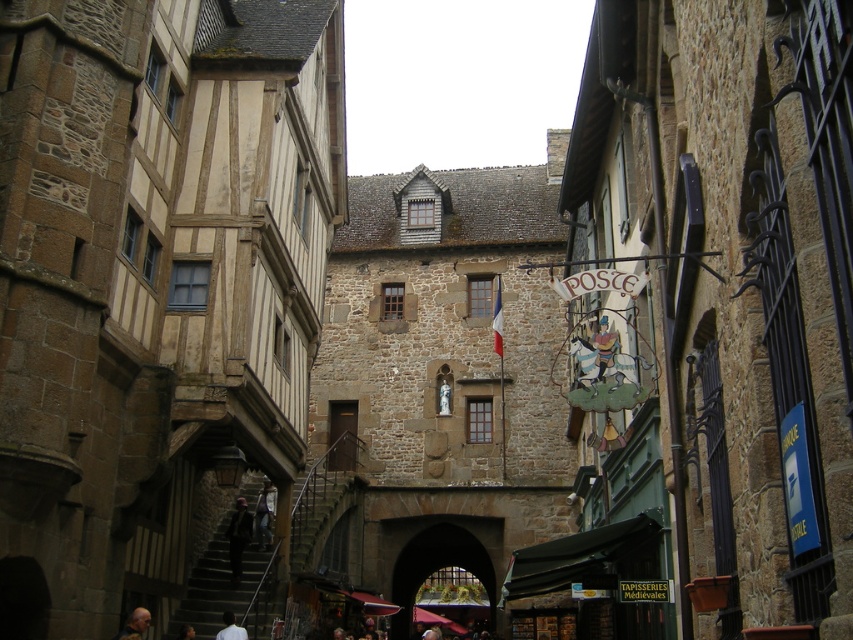
Question: Where is dark gray fabric jacket at lower center located in relation to brown leather jacket at lower center in the image?

Choices:
 (A) left
 (B) right

Answer: (B)

Question: Which object appears closest to the camera in this image?

Choices:
 (A) dark gray fabric jacket at lower center
 (B) white shirt at lower center
 (C) brown leather jacket at lower center

Answer: (C)

Question: Does dark gray fabric jacket at lower center appear over brown leather jacket at lower center?

Choices:
 (A) no
 (B) yes

Answer: (B)

Question: Among these points, which one is farthest from the camera?

Choices:
 (A) (274, 492)
 (B) (241, 515)
 (C) (241, 636)
 (D) (125, 627)

Answer: (A)

Question: Which point is farther to the camera?

Choices:
 (A) white shirt at lower center
 (B) dark gray fabric jacket at lower center
 (C) brown leather jacket at lower center

Answer: (B)

Question: Is dark brown leather jacket at lower left to the left of white shirt at lower center from the viewer's perspective?

Choices:
 (A) yes
 (B) no

Answer: (A)